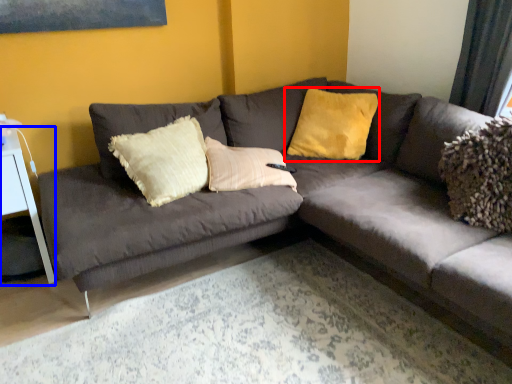
Question: Among these objects, which one is farthest to the camera, pillow (highlighted by a red box) or table (highlighted by a blue box)?

Choices:
 (A) pillow
 (B) table

Answer: (A)